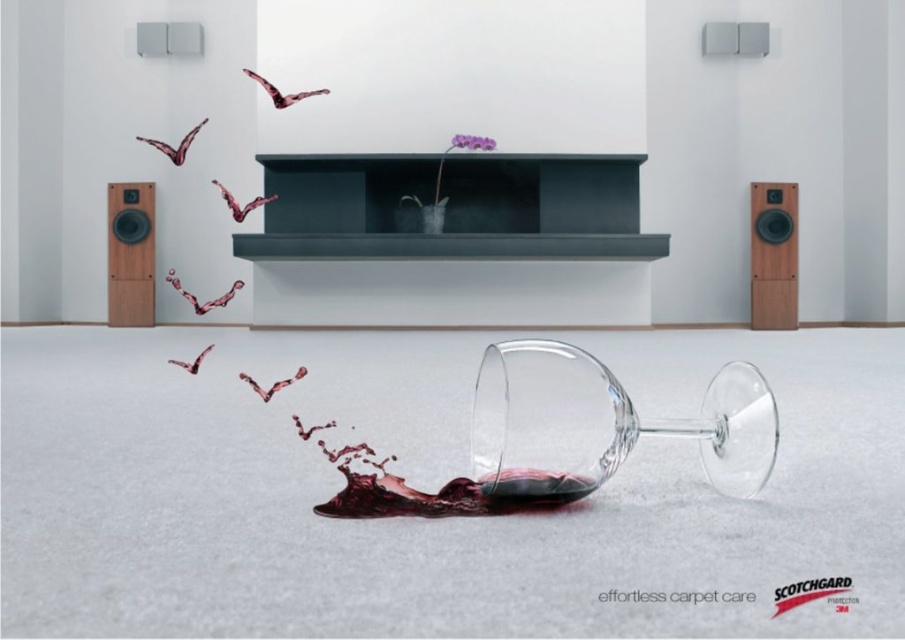
You are a cleaning robot tasked with cleaning the spilled dark red liquid at center. To reach it, you must navigate around the cherry wood speaker at right. Based on their positions, can you safely move past the speaker to access the spill?

The cherry wood speaker at right is located above the dark red liquid at center, so the robot can safely move past the speaker to access the spill since it is positioned above and not blocking the path directly.

You are a decorator trying to place a new rectangular rug in this room. The rug needs to be placed between the matte black fireplace at center and the cherry wood speaker at right. Given that the fireplace is wider than the speaker, which object should the rug be closer to to ensure it fits properly?

The rug should be closer to the cherry wood speaker at right because the matte black fireplace at center is wider, so placing the rug closer to the narrower speaker ensures better alignment and fit between the two objects.

You are a housekeeper entering a room and see the matte black fireplace at center and the dark red liquid at center. Which object is wider?

The matte black fireplace at center is wider than the dark red liquid at center.